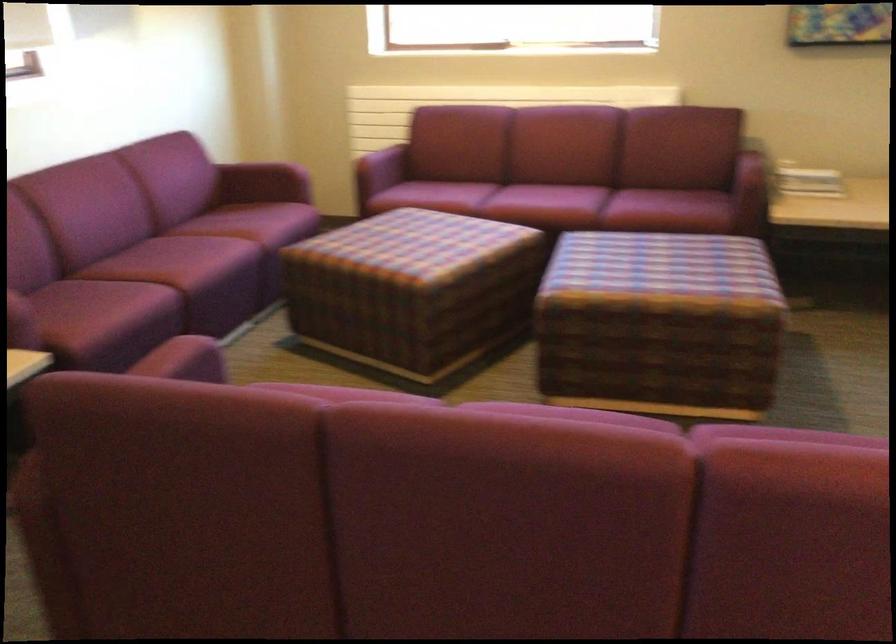
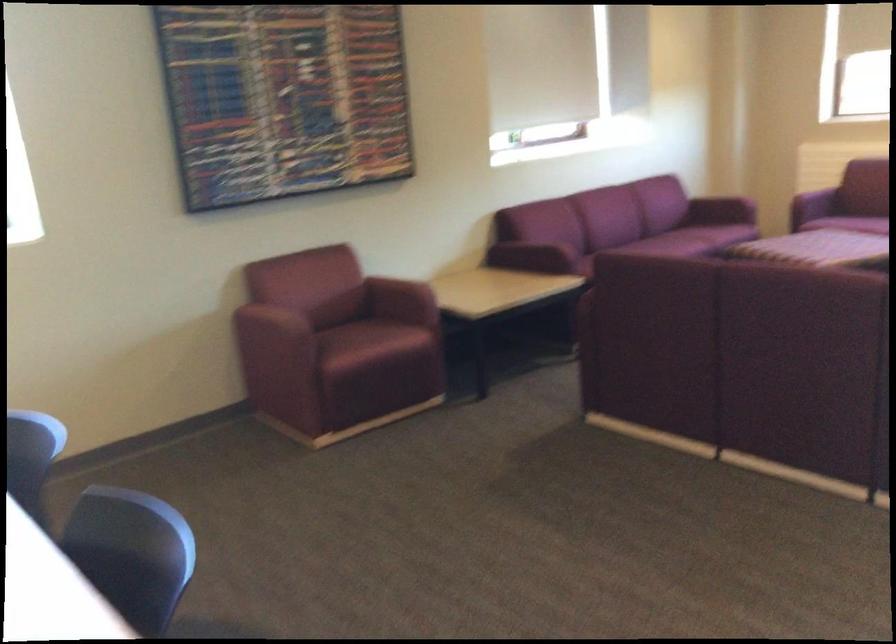
Question: I am providing you with two images of the same scene from different viewpoints. After the viewpoint changes to image2, which objects are now occluded?

Choices:
 (A) maroon chair armrest
 (B) maroon sofa sitting surface
 (C) beige slipper
 (D) purple sofa sitting surface

Answer: (D)